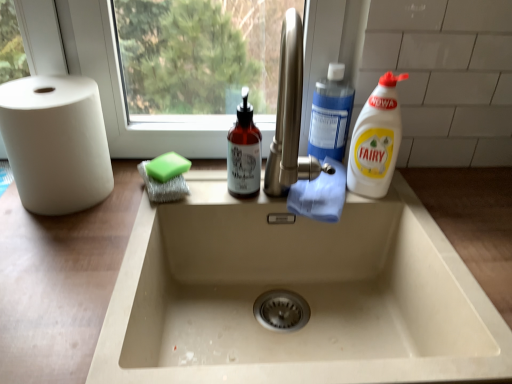
I want to click on blue plastic bottle at upper right, which is counted as the second cleaning product, starting from the left, so click(x=330, y=115).

Image resolution: width=512 pixels, height=384 pixels. What do you see at coordinates (56, 142) in the screenshot? I see `white matte paper towel at left` at bounding box center [56, 142].

Find the location of a particular element. The image size is (512, 384). green sponge at upper left is located at coordinates (167, 167).

Considering the points (343, 157) and (156, 180), which point is in front, point (343, 157) or point (156, 180)?

The point (156, 180) is closer to the camera.

Is blue plastic bottle at upper right, which is counted as the second cleaning product, starting from the left, further to the viewer compared to green sponge at upper left?

Yes, the depth of blue plastic bottle at upper right, which is counted as the second cleaning product, starting from the left, is greater than that of green sponge at upper left.

Which is more to the left, blue plastic bottle at upper right, acting as the second cleaning product starting from the right, or green sponge at upper left?

green sponge at upper left.

From a real-world perspective, between blue plastic bottle at upper right, which is counted as the second cleaning product, starting from the left, and green sponge at upper left, who is vertically higher?

blue plastic bottle at upper right, which is counted as the second cleaning product, starting from the left.

Considering the points (351, 90) and (248, 180), which point is in front, point (351, 90) or point (248, 180)?

The point (248, 180) is closer.

Considering the relative sizes of blue plastic bottle at upper right, which is counted as the second cleaning product, starting from the left, and translucent amber bottle at center, which is the 3th cleaning product in right-to-left order, in the image provided, is blue plastic bottle at upper right, which is counted as the second cleaning product, starting from the left, shorter than translucent amber bottle at center, which is the 3th cleaning product in right-to-left order,?

Yes.

Looking at this image, from the image's perspective, would you say blue plastic bottle at upper right, which is counted as the second cleaning product, starting from the left, is positioned over translucent amber bottle at center, which is the 3th cleaning product in right-to-left order?

Correct, blue plastic bottle at upper right, which is counted as the second cleaning product, starting from the left, appears higher than translucent amber bottle at center, which is the 3th cleaning product in right-to-left order, in the image.

Are translucent amber bottle at center, which is the 3th cleaning product in right-to-left order, and blue plastic bottle at upper right, acting as the second cleaning product starting from the right, located far from each other?

translucent amber bottle at center, which is the 3th cleaning product in right-to-left order, is actually quite close to blue plastic bottle at upper right, acting as the second cleaning product starting from the right.

Find the location of `cleaning product that is behind the translucent amber bottle at center, which is the 3th cleaning product in right-to-left order`. cleaning product that is behind the translucent amber bottle at center, which is the 3th cleaning product in right-to-left order is located at coordinates (330, 115).

Is point (255, 160) closer to camera compared to point (312, 146)?

Yes.

From the image's perspective, between white plastic bottle at right, marked as the third cleaning product in a left-to-right arrangement, and white matte paper towel at left, who is located below?

white matte paper towel at left appears lower in the image.

From a real-world perspective, which is physically below, white plastic bottle at right, positioned as the 1th cleaning product in right-to-left order, or white matte paper towel at left?

From a 3D spatial view, white matte paper towel at left is below.

Which is closer, (388, 111) or (87, 95)?

The point (87, 95) is in front.

Is white plastic bottle at right, marked as the third cleaning product in a left-to-right arrangement, to the left or to the right of translucent amber bottle at center, which is the 3th cleaning product in right-to-left order, in the image?

white plastic bottle at right, marked as the third cleaning product in a left-to-right arrangement, is positioned on translucent amber bottle at center, which is the 3th cleaning product in right-to-left order,'s right side.

Could you tell me if white plastic bottle at right, positioned as the 1th cleaning product in right-to-left order, is facing translucent amber bottle at center, the first cleaning product in the left-to-right sequence?

No.

From the image's perspective, count 1st cleaning products upward from the translucent amber bottle at center, the first cleaning product in the left-to-right sequence, and point to it. Please provide its 2D coordinates.

[(376, 140)]

From the picture: Could translucent amber bottle at center, the first cleaning product in the left-to-right sequence, be considered to be inside white plastic bottle at right, marked as the third cleaning product in a left-to-right arrangement?

No, translucent amber bottle at center, the first cleaning product in the left-to-right sequence, is not a part of white plastic bottle at right, marked as the third cleaning product in a left-to-right arrangement.

From a real-world perspective, is blue plastic bottle at upper right, which is counted as the second cleaning product, starting from the left, above or below white matte paper towel at left?

In terms of real-world spatial position, blue plastic bottle at upper right, which is counted as the second cleaning product, starting from the left, is above white matte paper towel at left.

Considering the relative sizes of blue plastic bottle at upper right, acting as the second cleaning product starting from the right, and white matte paper towel at left in the image provided, is blue plastic bottle at upper right, acting as the second cleaning product starting from the right, bigger than white matte paper towel at left?

No, blue plastic bottle at upper right, acting as the second cleaning product starting from the right, is not bigger than white matte paper towel at left.

Is blue plastic bottle at upper right, acting as the second cleaning product starting from the right, shorter than white matte paper towel at left?

Correct, blue plastic bottle at upper right, acting as the second cleaning product starting from the right, is not as tall as white matte paper towel at left.

Is blue plastic bottle at upper right, which is counted as the second cleaning product, starting from the left, not inside white matte paper towel at left?

Yes, blue plastic bottle at upper right, which is counted as the second cleaning product, starting from the left, is outside of white matte paper towel at left.

From a real-world perspective, is blue plastic bottle at upper right, acting as the second cleaning product starting from the right, positioned above or below white plastic bottle at right, positioned as the 1th cleaning product in right-to-left order?

blue plastic bottle at upper right, acting as the second cleaning product starting from the right, is situated higher than white plastic bottle at right, positioned as the 1th cleaning product in right-to-left order, in the real world.

Considering the positions of objects blue plastic bottle at upper right, which is counted as the second cleaning product, starting from the left, and white plastic bottle at right, positioned as the 1th cleaning product in right-to-left order, in the image provided, who is more to the right, blue plastic bottle at upper right, which is counted as the second cleaning product, starting from the left, or white plastic bottle at right, positioned as the 1th cleaning product in right-to-left order,?

Positioned to the right is white plastic bottle at right, positioned as the 1th cleaning product in right-to-left order.

Is blue plastic bottle at upper right, acting as the second cleaning product starting from the right, spatially inside white plastic bottle at right, positioned as the 1th cleaning product in right-to-left order, or outside of it?

blue plastic bottle at upper right, acting as the second cleaning product starting from the right, is outside white plastic bottle at right, positioned as the 1th cleaning product in right-to-left order.

Which object is further away from the camera, blue plastic bottle at upper right, which is counted as the second cleaning product, starting from the left, or white plastic bottle at right, positioned as the 1th cleaning product in right-to-left order?

blue plastic bottle at upper right, which is counted as the second cleaning product, starting from the left, is behind.

At what (x,y) coordinates should I click in order to perform the action: click on soap in front of the blue plastic bottle at upper right, acting as the second cleaning product starting from the right. Please return your answer as a coordinate pair (x, y). The image size is (512, 384). Looking at the image, I should click on (167, 167).

Identify the location of the 2nd cleaning product located beneath the blue plastic bottle at upper right, which is counted as the second cleaning product, starting from the left (from a real-world perspective). This screenshot has width=512, height=384. (244, 152).

Considering their positions, is green sponge at upper left positioned further to white matte paper towel at left than translucent amber bottle at center, which is the 3th cleaning product in right-to-left order?

The object further to white matte paper towel at left is translucent amber bottle at center, which is the 3th cleaning product in right-to-left order.

Based on their spatial positions, is green sponge at upper left or blue plastic bottle at upper right, acting as the second cleaning product starting from the right, further from white matte paper towel at left?

blue plastic bottle at upper right, acting as the second cleaning product starting from the right.

Based on their spatial positions, is white matte paper towel at left or translucent amber bottle at center, which is the 3th cleaning product in right-to-left order, further from green sponge at upper left?

Based on the image, white matte paper towel at left appears to be further to green sponge at upper left.

Which object lies further to the anchor point blue plastic bottle at upper right, acting as the second cleaning product starting from the right, green sponge at upper left or white matte paper towel at left?

white matte paper towel at left is positioned further to the anchor blue plastic bottle at upper right, acting as the second cleaning product starting from the right.

Looking at the image, which one is located further to green sponge at upper left, white matte paper towel at left or blue plastic bottle at upper right, acting as the second cleaning product starting from the right?

blue plastic bottle at upper right, acting as the second cleaning product starting from the right, is positioned further to the anchor green sponge at upper left.

Based on their spatial positions, is white matte paper towel at left or white plastic bottle at right, marked as the third cleaning product in a left-to-right arrangement, further from green sponge at upper left?

white plastic bottle at right, marked as the third cleaning product in a left-to-right arrangement, is further to green sponge at upper left.

When comparing their distances from white matte paper towel at left, does white plastic bottle at right, positioned as the 1th cleaning product in right-to-left order, or translucent amber bottle at center, which is the 3th cleaning product in right-to-left order, seem closer?

translucent amber bottle at center, which is the 3th cleaning product in right-to-left order.

Considering their positions, is white plastic bottle at right, marked as the third cleaning product in a left-to-right arrangement, positioned closer to translucent amber bottle at center, the first cleaning product in the left-to-right sequence, than green sponge at upper left?

green sponge at upper left lies closer to translucent amber bottle at center, the first cleaning product in the left-to-right sequence, than the other object.

The image size is (512, 384). What are the coordinates of `soap situated between white matte paper towel at left and blue plastic bottle at upper right, which is counted as the second cleaning product, starting from the left, from left to right` in the screenshot? It's located at (167, 167).

You are a GUI agent. You are given a task and a screenshot of the screen. Output one action in this format:
    pyautogui.click(x=<x>, y=<y>)
    Task: Click on the cleaning product between green sponge at upper left and blue plastic bottle at upper right, acting as the second cleaning product starting from the right
    The image size is (512, 384).
    Given the screenshot: What is the action you would take?
    pyautogui.click(x=244, y=152)

At what (x,y) coordinates should I click in order to perform the action: click on soap located between white matte paper towel at left and translucent amber bottle at center, which is the 3th cleaning product in right-to-left order, in the left-right direction. Please return your answer as a coordinate pair (x, y). The height and width of the screenshot is (384, 512). Looking at the image, I should click on (167, 167).

Where is `cleaning product between translucent amber bottle at center, the first cleaning product in the left-to-right sequence, and white plastic bottle at right, positioned as the 1th cleaning product in right-to-left order, in the horizontal direction`? The height and width of the screenshot is (384, 512). cleaning product between translucent amber bottle at center, the first cleaning product in the left-to-right sequence, and white plastic bottle at right, positioned as the 1th cleaning product in right-to-left order, in the horizontal direction is located at coordinates (330, 115).